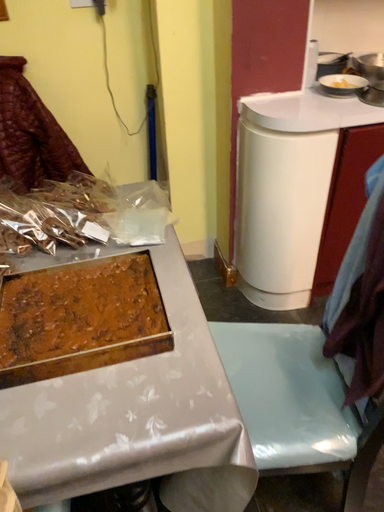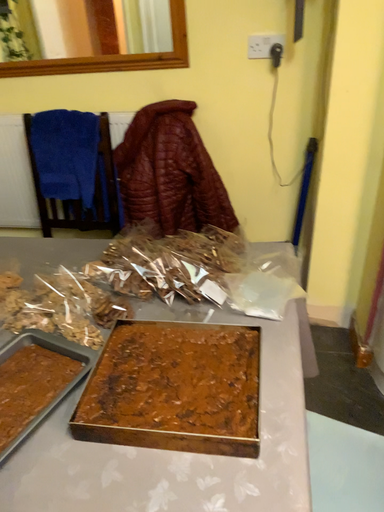
Question: Which way did the camera rotate in the video?

Choices:
 (A) rotated right
 (B) rotated left

Answer: (B)